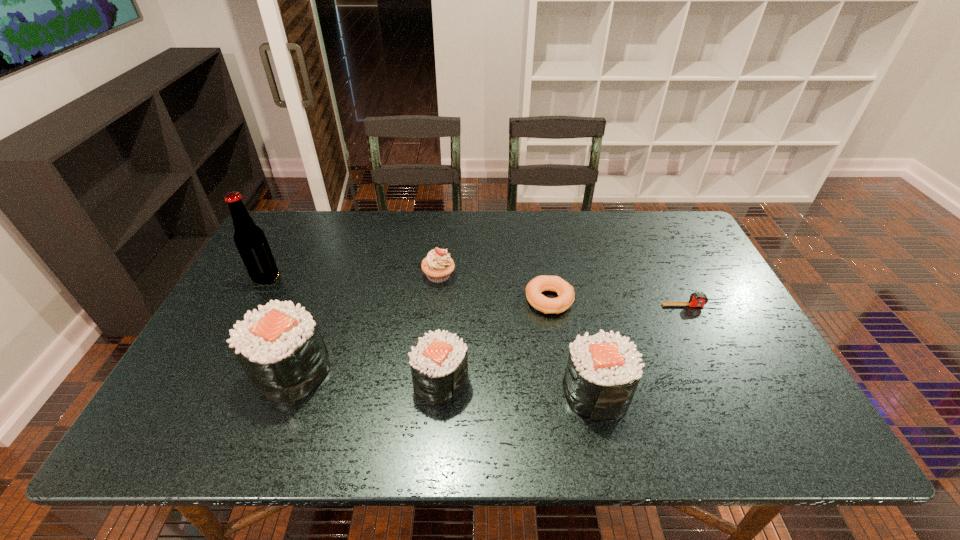
Image resolution: width=960 pixels, height=540 pixels. In order to click on free space between the beer bottle and the shortest sushi in this screenshot , I will do `click(353, 329)`.

Where is `empty space that is in between the cupcake and the bagel`? This screenshot has height=540, width=960. empty space that is in between the cupcake and the bagel is located at coordinates (494, 288).

This screenshot has height=540, width=960. I want to click on unoccupied area between the bagel and the cupcake, so click(x=494, y=288).

Find the location of a particular element. The image size is (960, 540). free space between the tape measure and the bagel is located at coordinates (621, 303).

This screenshot has width=960, height=540. I want to click on the second closest object relative to the cupcake, so click(439, 361).

Where is `the fourth closest object to the second object from left to right`? Image resolution: width=960 pixels, height=540 pixels. the fourth closest object to the second object from left to right is located at coordinates (565, 291).

Identify which sushi is the third closest to the cupcake. Please provide its 2D coordinates. Your answer should be formatted as a tuple, i.e. [(x, y)], where the tuple contains the x and y coordinates of a point satisfying the conditions above.

[(603, 371)]

Locate which sushi ranks third in proximity to the bagel. Please provide its 2D coordinates. Your answer should be formatted as a tuple, i.e. [(x, y)], where the tuple contains the x and y coordinates of a point satisfying the conditions above.

[(280, 348)]

Find the location of a particular element. The width and height of the screenshot is (960, 540). vacant point that satisfies the following two spatial constraints: 1. on the back side of the second sushi from left to right; 2. on the right side of the tape measure is located at coordinates (446, 306).

Identify the location of free region that satisfies the following two spatial constraints: 1. on the front side of the bagel; 2. on the left side of the beer bottle. Image resolution: width=960 pixels, height=540 pixels. (254, 300).